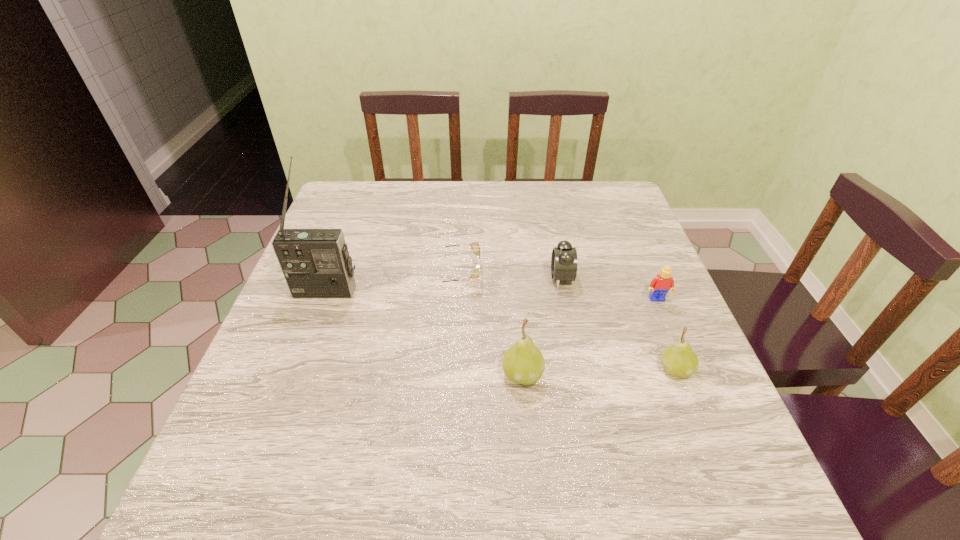
In the image, there is a desktop. Where is `vacant space at the far edge`? The width and height of the screenshot is (960, 540). vacant space at the far edge is located at coordinates (498, 190).

Locate an element on the screen. vacant space at the near edge of the desktop is located at coordinates (362, 438).

Where is `free space at the left edge`? Image resolution: width=960 pixels, height=540 pixels. free space at the left edge is located at coordinates (340, 335).

The height and width of the screenshot is (540, 960). I want to click on free space at the right edge of the desktop, so 697,353.

This screenshot has width=960, height=540. In the image, there is a desktop. In order to click on vacant area at the far left corner in this screenshot , I will do `click(324, 216)`.

At what (x,y) coordinates should I click in order to perform the action: click on blank area at the far right corner. Please return your answer as a coordinate pair (x, y). The height and width of the screenshot is (540, 960). Looking at the image, I should click on (633, 219).

The width and height of the screenshot is (960, 540). In order to click on free space at the near right corner in this screenshot , I will do `click(703, 407)`.

This screenshot has height=540, width=960. What are the coordinates of `unoccupied area between the alarm clock and the fourth object from right to left` in the screenshot? It's located at (542, 326).

Identify the location of free space between the shorter pear and the alarm clock. coord(618,323).

Identify the location of vacant area that lies between the Lego and the alarm clock. The width and height of the screenshot is (960, 540). (609, 288).